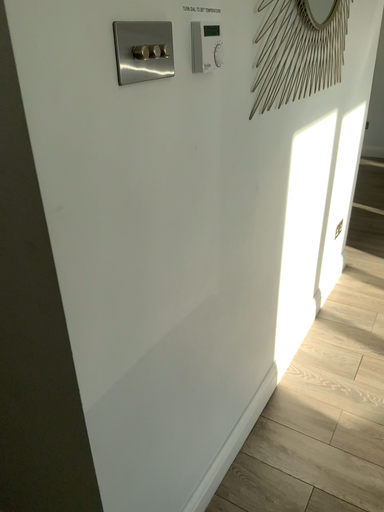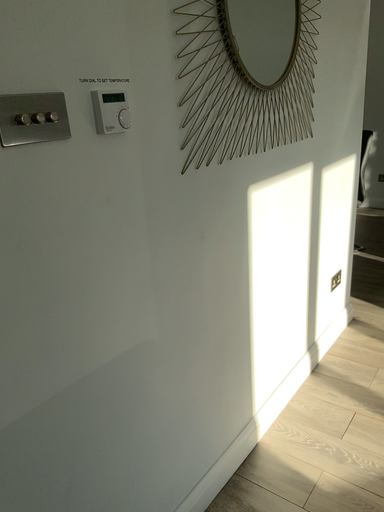
Question: Which way did the camera rotate in the video?

Choices:
 (A) rotated downward
 (B) rotated upward

Answer: (B)